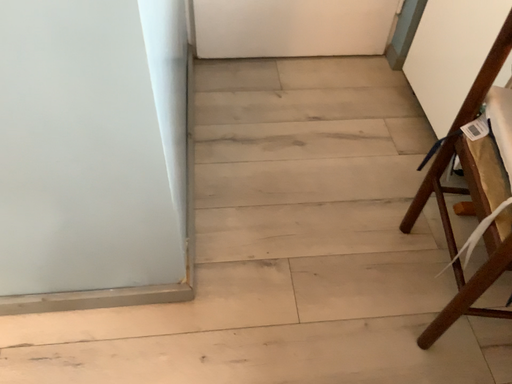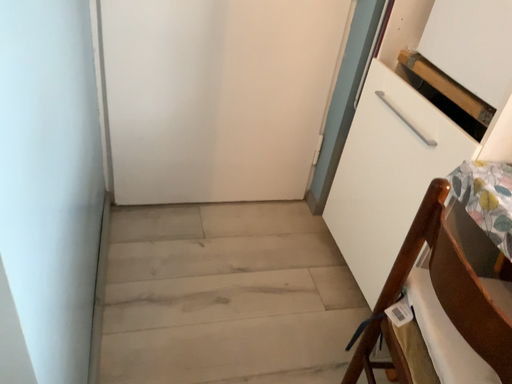
Question: Which way did the camera rotate in the video?

Choices:
 (A) rotated upward
 (B) rotated downward

Answer: (A)